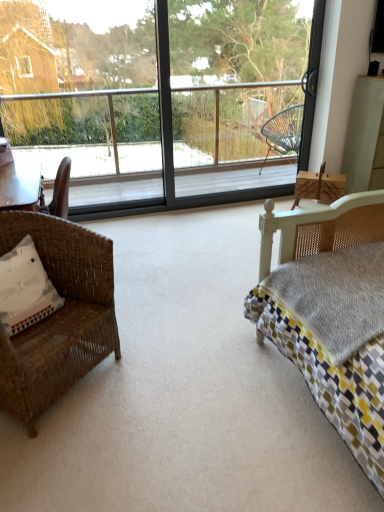
The image size is (384, 512). In order to click on free spot to the right of woven brown chair at left in this screenshot , I will do `click(160, 370)`.